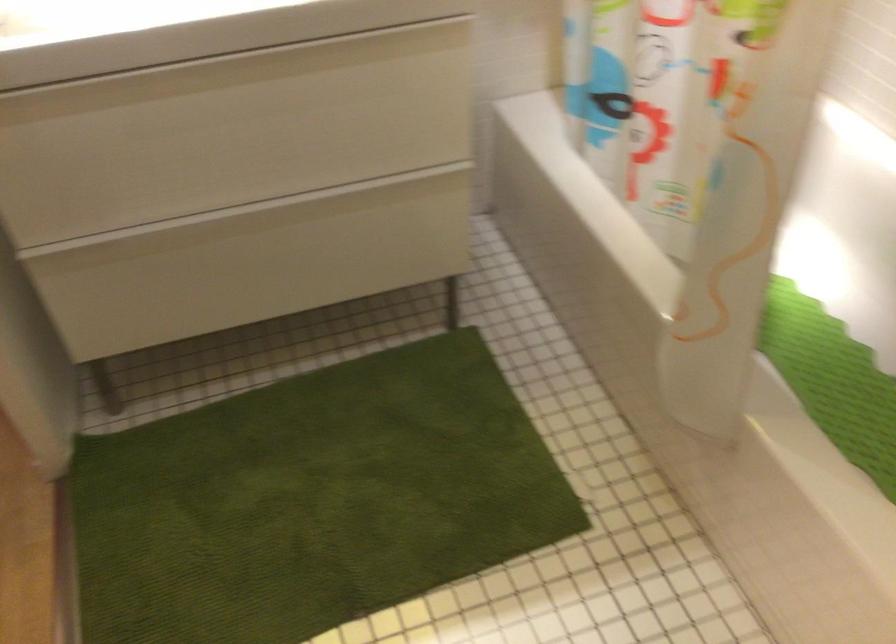
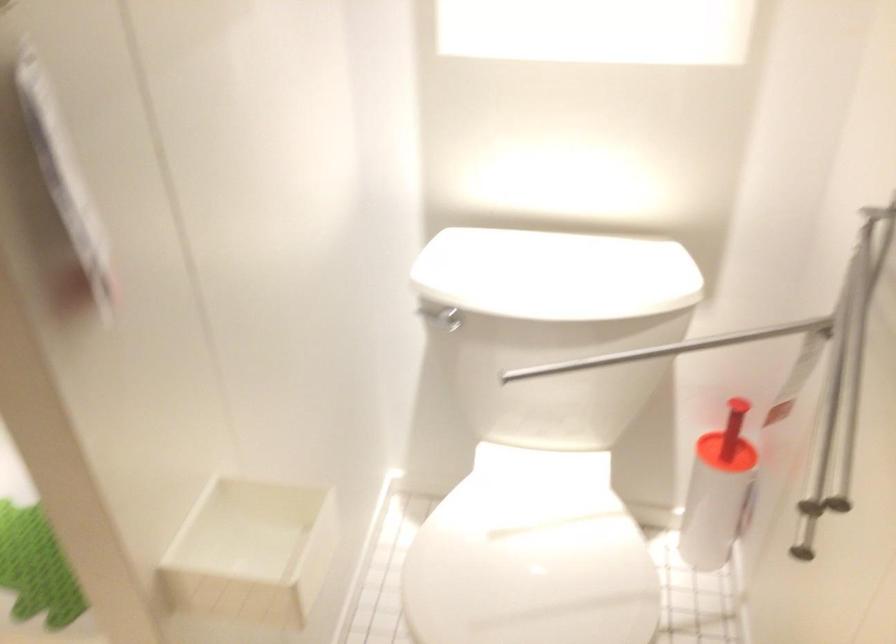
Question: The first image is from the beginning of the video and the second image is from the end. How did the camera likely rotate when shooting the video?

Choices:
 (A) Left
 (B) Right
 (C) Up
 (D) Down

Answer: (B)